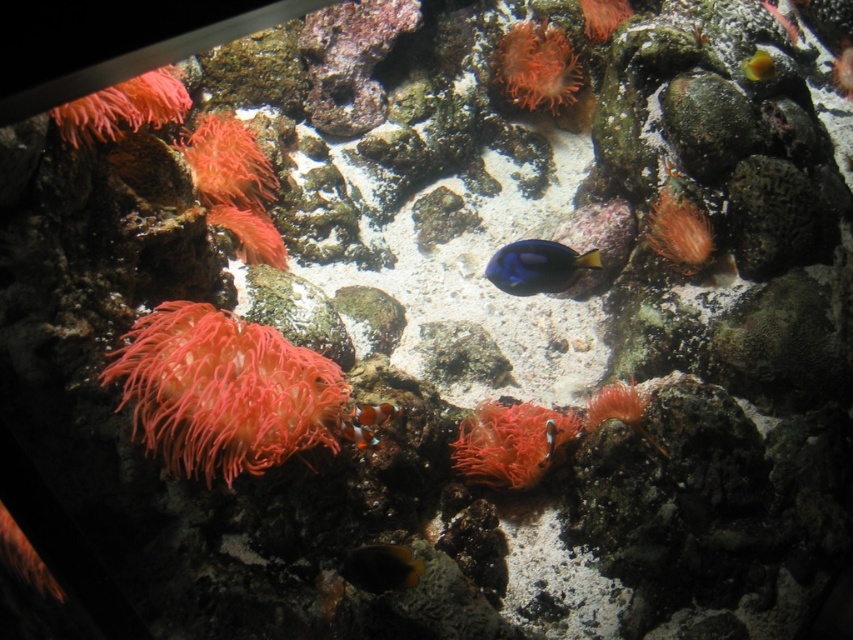
Is point (573, 278) positioned before point (399, 548)?

No, it is not.

Who is higher up, blue glossy fish at center or orange matte fish at center?

Positioned higher is blue glossy fish at center.

Which is behind, point (552, 256) or point (370, 550)?

Positioned behind is point (552, 256).

Locate an element on the screen. blue glossy fish at center is located at coordinates (537, 266).

Does fluffy coral at left appear on the left side of translucent yellow fish at upper right?

Correct, you'll find fluffy coral at left to the left of translucent yellow fish at upper right.

Consider the image. Can you confirm if fluffy coral at left is wider than translucent yellow fish at upper right?

Yes, fluffy coral at left is wider than translucent yellow fish at upper right.

Describe the element at coordinates (223, 390) in the screenshot. I see `fluffy coral at left` at that location.

At what (x,y) coordinates should I click in order to perform the action: click on fluffy coral at left. Please return your answer as a coordinate pair (x, y). Looking at the image, I should click on (223, 390).

Does bright red coral at center appear on the right side of soft coral at upper left?

Yes, bright red coral at center is to the right of soft coral at upper left.

Who is lower down, bright red coral at center or soft coral at upper left?

bright red coral at center is below.

Who is more distant from viewer, (x=523, y=483) or (x=126, y=92)?

Positioned behind is point (x=523, y=483).

Identify the location of bright red coral at center. (x=509, y=442).